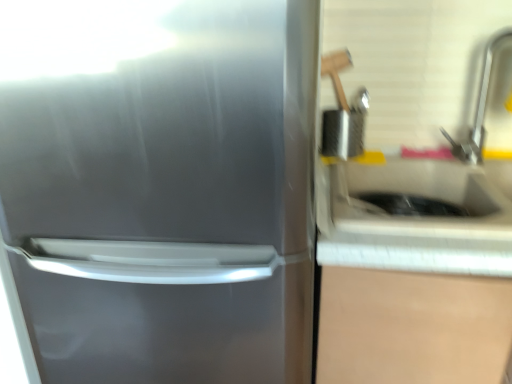
The height and width of the screenshot is (384, 512). Describe the element at coordinates (169, 202) in the screenshot. I see `satin silver refrigerator at left` at that location.

Where is `white glossy sink at right`? white glossy sink at right is located at coordinates (419, 220).

This screenshot has width=512, height=384. What do you see at coordinates (419, 220) in the screenshot?
I see `white glossy sink at right` at bounding box center [419, 220].

Describe the element at coordinates (478, 108) in the screenshot. I see `satin nickel faucet at upper right` at that location.

This screenshot has height=384, width=512. I want to click on satin silver refrigerator at left, so click(x=169, y=202).

Between satin silver refrigerator at left and white glossy sink at right, which one appears on the left side from the viewer's perspective?

Positioned to the left is satin silver refrigerator at left.

Considering the sizes of objects satin silver refrigerator at left and white glossy sink at right in the image provided, who is thinner, satin silver refrigerator at left or white glossy sink at right?

white glossy sink at right is thinner.

Is satin silver refrigerator at left taller or shorter than white glossy sink at right?

Clearly, satin silver refrigerator at left is taller compared to white glossy sink at right.

Which of these two, satin silver refrigerator at left or white glossy sink at right, is smaller?

With smaller size is white glossy sink at right.

From the image's perspective, which is below, white glossy sink at right or satin nickel faucet at upper right?

From the image's view, white glossy sink at right is below.

Based on the photo, in the image, is white glossy sink at right on the left side or the right side of satin nickel faucet at upper right?

From the image, it's evident that white glossy sink at right is to the left of satin nickel faucet at upper right.

From a real-world perspective, is white glossy sink at right physically located above or below satin nickel faucet at upper right?

From a real-world perspective, white glossy sink at right is physically below satin nickel faucet at upper right.

Who is taller, white glossy sink at right or satin nickel faucet at upper right?

satin nickel faucet at upper right is taller.

From the image's perspective, which one is positioned higher, white glossy sink at right or satin silver refrigerator at left?

white glossy sink at right, from the image's perspective.

How many degrees apart are the facing directions of white glossy sink at right and satin silver refrigerator at left?

The angle between the facing direction of white glossy sink at right and the facing direction of satin silver refrigerator at left is 1.19e-05 degrees.

Who is taller, white glossy sink at right or satin silver refrigerator at left?

satin silver refrigerator at left.

Looking at this image, is white glossy sink at right spatially inside satin silver refrigerator at left, or outside of it?

The correct answer is: outside.

Considering the sizes of satin nickel faucet at upper right and satin silver refrigerator at left in the image, is satin nickel faucet at upper right wider or thinner than satin silver refrigerator at left?

Clearly, satin nickel faucet at upper right has less width compared to satin silver refrigerator at left.

Which is more to the right, satin nickel faucet at upper right or satin silver refrigerator at left?

Positioned to the right is satin nickel faucet at upper right.

From a real-world perspective, who is located higher, satin nickel faucet at upper right or satin silver refrigerator at left?

satin nickel faucet at upper right.

Does satin nickel faucet at upper right come in front of satin silver refrigerator at left?

No, satin nickel faucet at upper right is further to the viewer.

From the image's perspective, would you say satin nickel faucet at upper right is shown under white glossy sink at right?

Actually, satin nickel faucet at upper right appears above white glossy sink at right in the image.

Does satin nickel faucet at upper right appear on the right side of white glossy sink at right?

Yes, satin nickel faucet at upper right is to the right of white glossy sink at right.

Consider the image. Considering the relative positions of satin nickel faucet at upper right and white glossy sink at right in the image provided, is satin nickel faucet at upper right in front of white glossy sink at right?

That is False.

Is satin nickel faucet at upper right turned away from white glossy sink at right?

No, satin nickel faucet at upper right's orientation is not away from white glossy sink at right.

From the image's perspective, does satin silver refrigerator at left appear higher than satin nickel faucet at upper right?

Actually, satin silver refrigerator at left appears below satin nickel faucet at upper right in the image.

Between satin silver refrigerator at left and satin nickel faucet at upper right, which one is positioned behind?

satin nickel faucet at upper right.

Considering the positions of points (202, 70) and (481, 158), is point (202, 70) closer to camera compared to point (481, 158)?

Yes, it is in front of point (481, 158).

Image resolution: width=512 pixels, height=384 pixels. Find the location of `counter top above the satin silver refrigerator at left (from a real-world perspective)`. counter top above the satin silver refrigerator at left (from a real-world perspective) is located at coordinates (419, 220).

At what (x,y) coordinates should I click in order to perform the action: click on faucet above the white glossy sink at right (from the image's perspective). Please return your answer as a coordinate pair (x, y). Image resolution: width=512 pixels, height=384 pixels. Looking at the image, I should click on (478, 108).

Estimate the real-world distances between objects in this image. Which object is further from satin silver refrigerator at left, white glossy sink at right or satin nickel faucet at upper right?

satin nickel faucet at upper right is positioned further to the anchor satin silver refrigerator at left.

Estimate the real-world distances between objects in this image. Which object is closer to satin nickel faucet at upper right, satin silver refrigerator at left or white glossy sink at right?

white glossy sink at right is positioned closer to the anchor satin nickel faucet at upper right.

From the image, which object appears to be nearer to satin silver refrigerator at left, satin nickel faucet at upper right or white glossy sink at right?

white glossy sink at right is positioned closer to the anchor satin silver refrigerator at left.

Consider the image. When comparing their distances from white glossy sink at right, does satin silver refrigerator at left or satin nickel faucet at upper right seem further?

The object further to white glossy sink at right is satin silver refrigerator at left.

When comparing their distances from satin nickel faucet at upper right, does white glossy sink at right or satin silver refrigerator at left seem closer?

white glossy sink at right.

Based on their spatial positions, is satin nickel faucet at upper right or satin silver refrigerator at left further from white glossy sink at right?

Based on the image, satin silver refrigerator at left appears to be further to white glossy sink at right.

This screenshot has width=512, height=384. I want to click on counter top between satin silver refrigerator at left and satin nickel faucet at upper right, so click(419, 220).